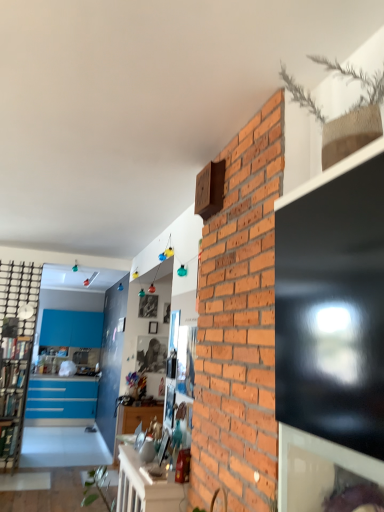
Image resolution: width=384 pixels, height=512 pixels. Describe the element at coordinates (16, 353) in the screenshot. I see `black metal bookshelf at left` at that location.

What is the approximate width of black metal bookshelf at left?

1.03 inches.

Locate an element on the screen. black metal bookshelf at left is located at coordinates (16, 353).

This screenshot has width=384, height=512. I want to click on white glossy table at lower center, so click(146, 487).

Image resolution: width=384 pixels, height=512 pixels. Describe the element at coordinates (146, 487) in the screenshot. I see `white glossy table at lower center` at that location.

Where is `black metal bookshelf at left`? Image resolution: width=384 pixels, height=512 pixels. black metal bookshelf at left is located at coordinates (16, 353).

Is black metal bookshelf at left to the left or to the right of white glossy table at lower center in the image?

black metal bookshelf at left is to the left of white glossy table at lower center.

Does black metal bookshelf at left lie behind white glossy table at lower center?

Yes, it is.

Does point (5, 305) come closer to viewer compared to point (183, 499)?

No, (5, 305) is behind (183, 499).

From the image's perspective, does black metal bookshelf at left appear lower than white glossy table at lower center?

Actually, black metal bookshelf at left appears above white glossy table at lower center in the image.

From a real-world perspective, which is physically below, black metal bookshelf at left or white glossy table at lower center?

white glossy table at lower center is physically lower.

Is black metal bookshelf at left thinner than white glossy table at lower center?

Indeed, black metal bookshelf at left has a lesser width compared to white glossy table at lower center.

Between black metal bookshelf at left and white glossy table at lower center, which one has more height?

black metal bookshelf at left is taller.

Between black metal bookshelf at left and white glossy table at lower center, which one has smaller size?

black metal bookshelf at left.

Is white glossy table at lower center located within black metal bookshelf at left?

No, white glossy table at lower center is not a part of black metal bookshelf at left.

Are black metal bookshelf at left and white glossy table at lower center far apart?

Absolutely, black metal bookshelf at left is distant from white glossy table at lower center.

Could you tell me if black metal bookshelf at left is facing white glossy table at lower center?

No, black metal bookshelf at left is not oriented towards white glossy table at lower center.

This screenshot has height=512, width=384. I want to click on table below the black metal bookshelf at left (from a real-world perspective), so click(x=146, y=487).

Can you confirm if white glossy table at lower center is positioned to the left of black metal bookshelf at left?

No, white glossy table at lower center is not to the left of black metal bookshelf at left.

In the image, is white glossy table at lower center positioned in front of or behind black metal bookshelf at left?

In the image, white glossy table at lower center appears in front of black metal bookshelf at left.

Is point (184, 496) behind point (29, 269)?

No, it is in front of (29, 269).

Looking at this image, from the image's perspective, between white glossy table at lower center and black metal bookshelf at left, who is located below?

white glossy table at lower center is shown below in the image.

From a real-world perspective, is white glossy table at lower center over black metal bookshelf at left?

No.

Considering the relative sizes of white glossy table at lower center and black metal bookshelf at left in the image provided, is white glossy table at lower center thinner than black metal bookshelf at left?

Incorrect, the width of white glossy table at lower center is not less than that of black metal bookshelf at left.

Can you confirm if white glossy table at lower center is taller than black metal bookshelf at left?

Incorrect, the height of white glossy table at lower center is not larger of that of black metal bookshelf at left.

Consider the image. Which of these two, white glossy table at lower center or black metal bookshelf at left, is smaller?

Smaller between the two is black metal bookshelf at left.

Is white glossy table at lower center completely or partially outside of black metal bookshelf at left?

Yes, white glossy table at lower center is outside of black metal bookshelf at left.

Is white glossy table at lower center far away from black metal bookshelf at left?

white glossy table at lower center is far away from black metal bookshelf at left.

Is black metal bookshelf at left at the back of white glossy table at lower center?

white glossy table at lower center is not turned away from black metal bookshelf at left.

How many degrees apart are the facing directions of white glossy table at lower center and black metal bookshelf at left?

90.9 degrees.

This screenshot has width=384, height=512. What are the coordinates of `table in front of the black metal bookshelf at left` in the screenshot? It's located at pyautogui.click(x=146, y=487).

You are a GUI agent. You are given a task and a screenshot of the screen. Output one action in this format:
    pyautogui.click(x=<x>, y=<y>)
    Task: Click on the table below the black metal bookshelf at left (from a real-world perspective)
    This screenshot has height=512, width=384.
    Given the screenshot: What is the action you would take?
    pyautogui.click(x=146, y=487)

Identify the location of table that is in front of the black metal bookshelf at left. The width and height of the screenshot is (384, 512). (146, 487).